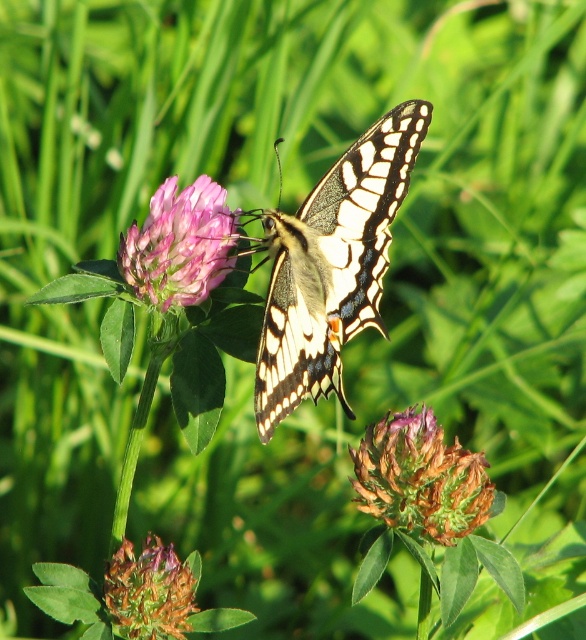
You are a drone operator trying to capture a photo of the butterfly and the clover flower. You have two points marked on your screen at coordinates point (264, 358) and point (155, 580). Which point should you aim the camera at to ensure the butterfly is in focus while avoiding the clover flower?

You should aim the camera at point (155, 580) because point (264, 358) is in front of it, meaning the butterfly is closer to the camera at that point. By focusing on point (155, 580), you can avoid the foreground obstruction of the clover flower and capture the butterfly clearly.

You are an entomologist observing the translucent yellow butterfly at center and the brown textured flower at lower left in the image. Which object takes up more space in the image?

The translucent yellow butterfly at center is bigger than the brown textured flower at lower left, so it takes up more space in the image.

You are an entomologist observing the scene. You need to determine the relative positions of the translucent yellow butterfly at center and the pink velvet clover at center. According to the image, which object is positioned to the right?

The translucent yellow butterfly at center is positioned to the right of the pink velvet clover at center.